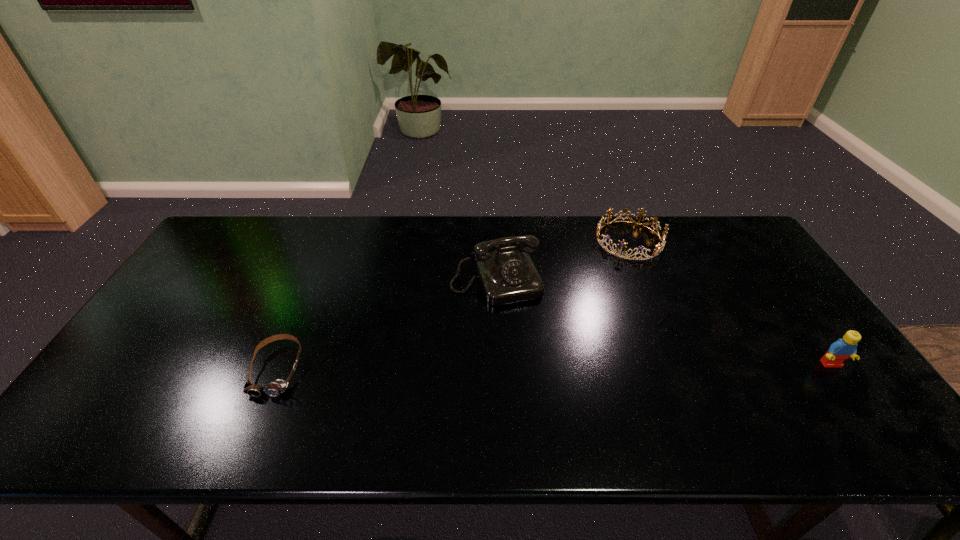
Where is `goggles`? This screenshot has width=960, height=540. goggles is located at coordinates (276, 388).

This screenshot has height=540, width=960. Identify the location of the leftmost object. (276, 388).

The width and height of the screenshot is (960, 540). Identify the location of Lego. (842, 349).

Locate an element on the screen. Image resolution: width=960 pixels, height=540 pixels. the rightmost object is located at coordinates (842, 349).

Where is `telephone`? Image resolution: width=960 pixels, height=540 pixels. telephone is located at coordinates (507, 275).

You are a GUI agent. You are given a task and a screenshot of the screen. Output one action in this format:
    pyautogui.click(x=<x>, y=<y>)
    Task: Click on the second shortest object
    The height and width of the screenshot is (540, 960).
    Given the screenshot: What is the action you would take?
    pyautogui.click(x=659, y=247)

You are a GUI agent. You are given a task and a screenshot of the screen. Output one action in this format:
    pyautogui.click(x=<x>, y=<y>)
    Task: Click on the tiara
    
    Given the screenshot: What is the action you would take?
    pyautogui.click(x=659, y=247)

At what (x,y) coordinates should I click in order to perform the action: click on vacant space located 0.100m on the face of the Lego. Please return your answer as a coordinate pair (x, y). The width and height of the screenshot is (960, 540). Looking at the image, I should click on point(861,406).

This screenshot has height=540, width=960. In order to click on free space located on the dial of the telephone in this screenshot , I will do `click(534, 373)`.

Where is `free point located 0.110m on the dial of the telephone`? free point located 0.110m on the dial of the telephone is located at coordinates (518, 334).